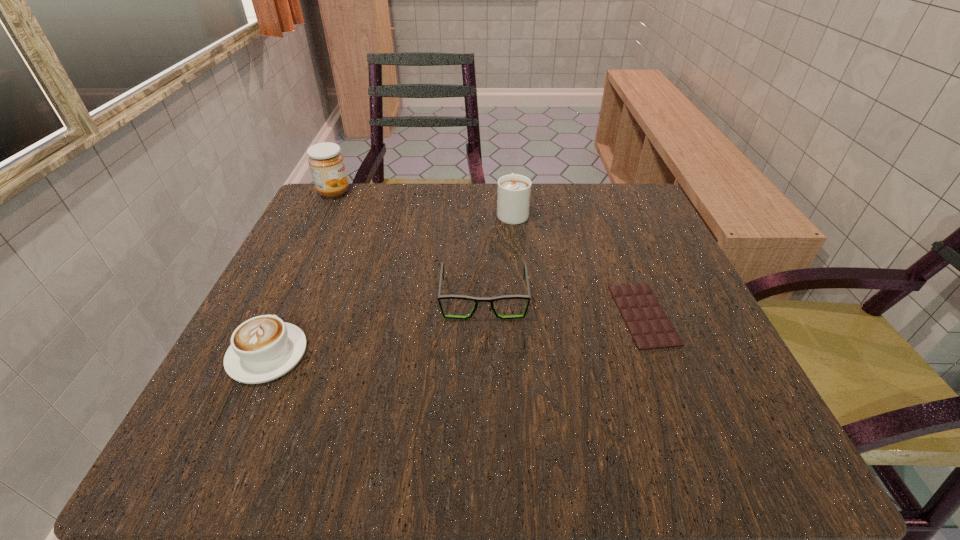
Locate an element on the screen. This screenshot has height=540, width=960. vacant area that lies between the chocolate bar and the nearer cappuccino is located at coordinates (455, 334).

Identify the location of empty space between the spectacles and the taller cappuccino. (498, 255).

Image resolution: width=960 pixels, height=540 pixels. What are the coordinates of `free space between the chocolate bar and the nearer cappuccino` in the screenshot? It's located at (455, 334).

Where is `blank region between the spectacles and the shorter cappuccino`? Image resolution: width=960 pixels, height=540 pixels. blank region between the spectacles and the shorter cappuccino is located at coordinates (375, 327).

At what (x,y) coordinates should I click in order to perform the action: click on free space between the spectacles and the shorter cappuccino. Please return your answer as a coordinate pair (x, y). This screenshot has height=540, width=960. Looking at the image, I should click on (375, 327).

The image size is (960, 540). What are the coordinates of `free point between the farther cappuccino and the left cappuccino` in the screenshot? It's located at (390, 283).

Identify the location of vacant area that lies between the right cappuccino and the rightmost object. (578, 263).

Where is `object that is the second nearest to the tallest object`? object that is the second nearest to the tallest object is located at coordinates (475, 299).

Choose which object is the third nearest neighbor to the chocolate bar. Please provide its 2D coordinates. Your answer should be formatted as a tuple, i.e. [(x, y)], where the tuple contains the x and y coordinates of a point satisfying the conditions above.

[(263, 348)]

The image size is (960, 540). Identify the location of free location that satisfies the following two spatial constraints: 1. on the front label of the chocolate bar; 2. on the right side of the jam. (274, 315).